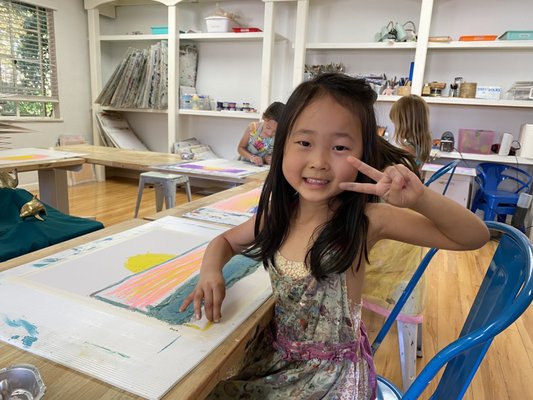
At what (x,y) coordinates should I click in order to perform the action: click on cords. Please return your answer as a coordinate pair (x, y). Image resolution: width=533 pixels, height=400 pixels. Looking at the image, I should click on (461, 158), (516, 166).